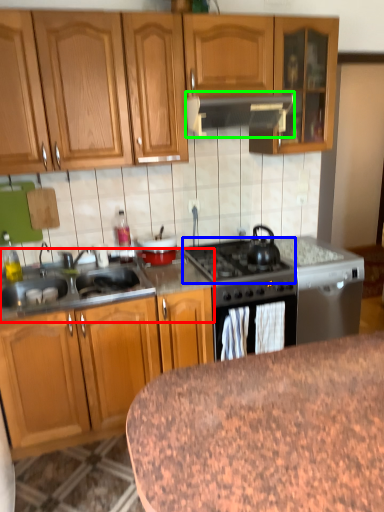
Question: Based on their relative distances, which object is nearer to countertop (highlighted by a red box)? Choose from gas stove (highlighted by a blue box) and kitchen appliance (highlighted by a green box).

Choices:
 (A) gas stove
 (B) kitchen appliance

Answer: (A)